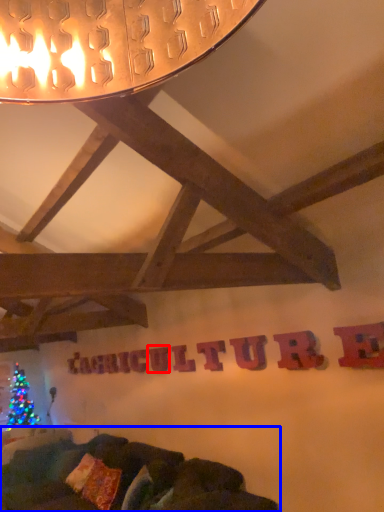
Question: Which object is closer to the camera taking this photo, letter (highlighted by a red box) or studio couch (highlighted by a blue box)?

Choices:
 (A) letter
 (B) studio couch

Answer: (B)